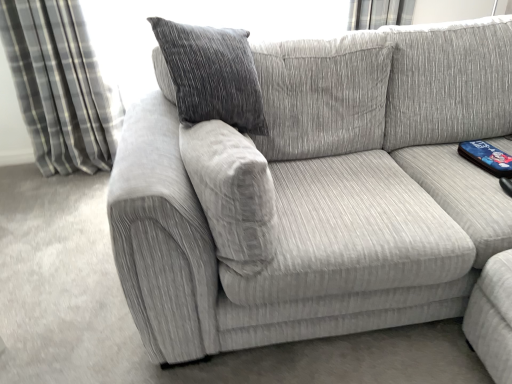
What do you see at coordinates (60, 86) in the screenshot? I see `gray plaid curtain at left` at bounding box center [60, 86].

What is the approximate width of gray plaid curtain at left?

gray plaid curtain at left is 12.69 inches wide.

At what (x,y) coordinates should I click in order to perform the action: click on gray plaid curtain at left. Please return your answer as a coordinate pair (x, y). This screenshot has width=512, height=384. Looking at the image, I should click on (60, 86).

What are the coordinates of `textured fabric couch at center` in the screenshot? It's located at (317, 193).

The image size is (512, 384). What do you see at coordinates (317, 193) in the screenshot?
I see `textured fabric couch at center` at bounding box center [317, 193].

Where is `gray plaid curtain at left`? gray plaid curtain at left is located at coordinates (60, 86).

In the image, is gray plaid curtain at left on the left side or the right side of textured fabric couch at center?

Clearly, gray plaid curtain at left is on the left of textured fabric couch at center in the image.

Does gray plaid curtain at left come behind textured fabric couch at center?

That is True.

Considering the points (55, 110) and (190, 272), which point is in front, point (55, 110) or point (190, 272)?

The point (190, 272) is more forward.

From the image's perspective, which object appears higher, gray plaid curtain at left or textured fabric couch at center?

gray plaid curtain at left is shown above in the image.

From a real-world perspective, is gray plaid curtain at left positioned above or below textured fabric couch at center?

In terms of real-world spatial position, gray plaid curtain at left is above textured fabric couch at center.

Which object is thinner, gray plaid curtain at left or textured fabric couch at center?

Thinner between the two is gray plaid curtain at left.

Who is taller, gray plaid curtain at left or textured fabric couch at center?

Standing taller between the two is gray plaid curtain at left.

In terms of size, does gray plaid curtain at left appear bigger or smaller than textured fabric couch at center?

Considering their sizes, gray plaid curtain at left takes up less space than textured fabric couch at center.

Would you say gray plaid curtain at left contains textured fabric couch at center?

That's incorrect, textured fabric couch at center is not inside gray plaid curtain at left.

Are gray plaid curtain at left and textured fabric couch at center beside each other?

gray plaid curtain at left is not next to textured fabric couch at center, and they're not touching.

Is gray plaid curtain at left facing towards textured fabric couch at center?

No, gray plaid curtain at left does not turn towards textured fabric couch at center.

Where is `studio couch located below the gray plaid curtain at left (from the image's perspective)`? studio couch located below the gray plaid curtain at left (from the image's perspective) is located at coordinates (317, 193).

Visually, is textured fabric couch at center positioned to the left or to the right of gray plaid curtain at left?

Based on their positions, textured fabric couch at center is located to the right of gray plaid curtain at left.

Is textured fabric couch at center further to camera compared to gray plaid curtain at left?

No, textured fabric couch at center is closer to the camera.

Considering the points (131, 163) and (5, 23), which point is in front, point (131, 163) or point (5, 23)?

Point (131, 163)

From the image's perspective, between textured fabric couch at center and gray plaid curtain at left, which one is located above?

gray plaid curtain at left appears higher in the image.

From a real-world perspective, is textured fabric couch at center positioned over gray plaid curtain at left based on gravity?

No, from a real-world perspective, textured fabric couch at center is not above gray plaid curtain at left.

Which object is wider, textured fabric couch at center or gray plaid curtain at left?

textured fabric couch at center.

Can you confirm if textured fabric couch at center is shorter than gray plaid curtain at left?

Correct, textured fabric couch at center is not as tall as gray plaid curtain at left.

Is textured fabric couch at center bigger than gray plaid curtain at left?

Yes.

Which is correct: textured fabric couch at center is inside gray plaid curtain at left, or outside of it?

textured fabric couch at center is not inside gray plaid curtain at left, it's outside.

In the scene shown: Is textured fabric couch at center not close to gray plaid curtain at left?

textured fabric couch at center is far away from gray plaid curtain at left.

From the picture: Is textured fabric couch at center oriented away from gray plaid curtain at left?

No, textured fabric couch at center's orientation is not away from gray plaid curtain at left.

What's the angular difference between textured fabric couch at center and gray plaid curtain at left's facing directions?

The angle between the facing direction of textured fabric couch at center and the facing direction of gray plaid curtain at left is 4.1 degrees.

Image resolution: width=512 pixels, height=384 pixels. Identify the location of studio couch that appears below the gray plaid curtain at left (from the image's perspective). (317, 193).

Image resolution: width=512 pixels, height=384 pixels. In order to click on studio couch below the gray plaid curtain at left (from the image's perspective) in this screenshot , I will do `click(317, 193)`.

Locate an element on the screen. This screenshot has width=512, height=384. curtain that is on the left side of textured fabric couch at center is located at coordinates tap(60, 86).